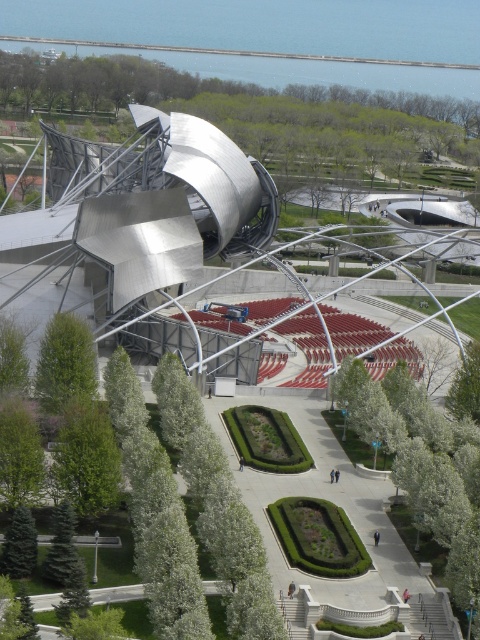
Question: Is the position of green leafy tree at center more distant than that of green leafy tree at lower left?

Choices:
 (A) yes
 (B) no

Answer: (B)

Question: Does green leafy tree at center have a lesser width compared to green leafy tree at lower left?

Choices:
 (A) no
 (B) yes

Answer: (A)

Question: Is green leafy tree at center positioned in front of green leafy tree at lower left?

Choices:
 (A) yes
 (B) no

Answer: (A)

Question: Which of the following is the farthest from the observer?

Choices:
 (A) pos(52,349)
 (B) pos(466,445)

Answer: (A)